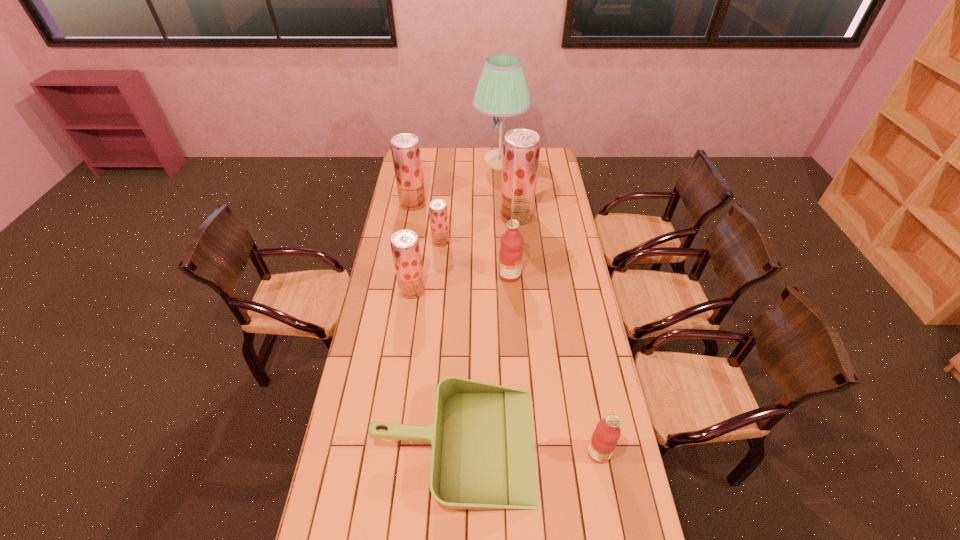
You are a GUI agent. You are given a task and a screenshot of the screen. Output one action in this format:
    pyautogui.click(x=<x>, y=<y>)
    Task: Click on the teal lamp
    
    Given the screenshot: What is the action you would take?
    pyautogui.click(x=502, y=91)

You are a GUI agent. You are given a task and a screenshot of the screen. Output one action in this format:
    pyautogui.click(x=<x>, y=<y>)
    Task: Click on the tallest object
    
    Given the screenshot: What is the action you would take?
    pyautogui.click(x=502, y=91)

Image resolution: width=960 pixels, height=540 pixels. What are the coordinates of `the rightmost strawberry fruit juice` in the screenshot? It's located at (521, 147).

The width and height of the screenshot is (960, 540). I want to click on the seventh shortest object, so click(x=521, y=147).

This screenshot has width=960, height=540. I want to click on the second tallest fruit juice, so click(405, 148).

Where is `the sixth shortest object`? The width and height of the screenshot is (960, 540). the sixth shortest object is located at coordinates (405, 148).

At what (x,y) coordinates should I click in order to perform the action: click on the nearest strawberry fruit juice. Please return your answer as a coordinate pair (x, y). Looking at the image, I should click on (405, 246).

The image size is (960, 540). I want to click on the bigger pink fruit juice, so click(511, 252).

Locate an element on the screen. The image size is (960, 540). the left pink fruit juice is located at coordinates (511, 252).

This screenshot has height=540, width=960. What are the coordinates of `the right pink fruit juice` in the screenshot? It's located at (605, 437).